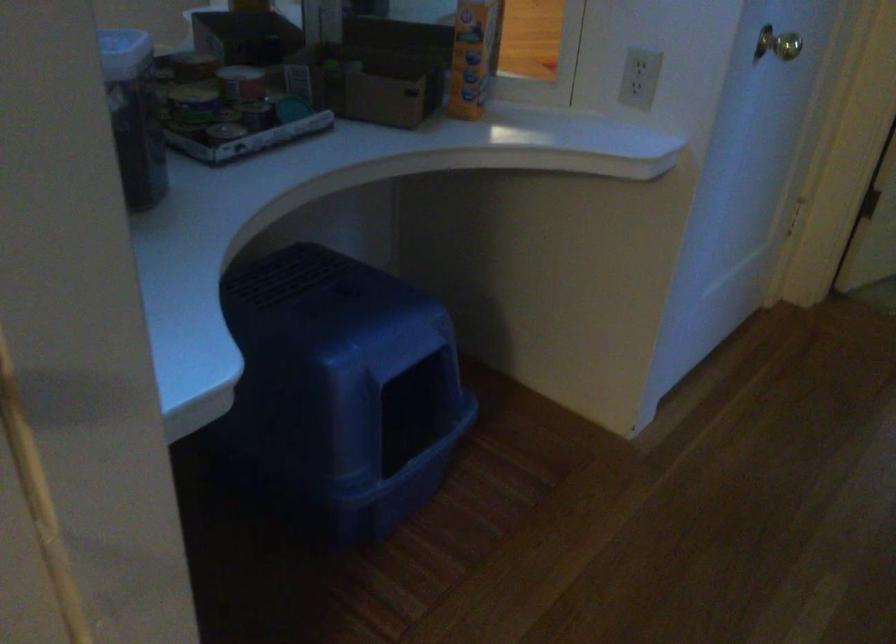
Describe the element at coordinates (778, 44) in the screenshot. I see `a brass door knob` at that location.